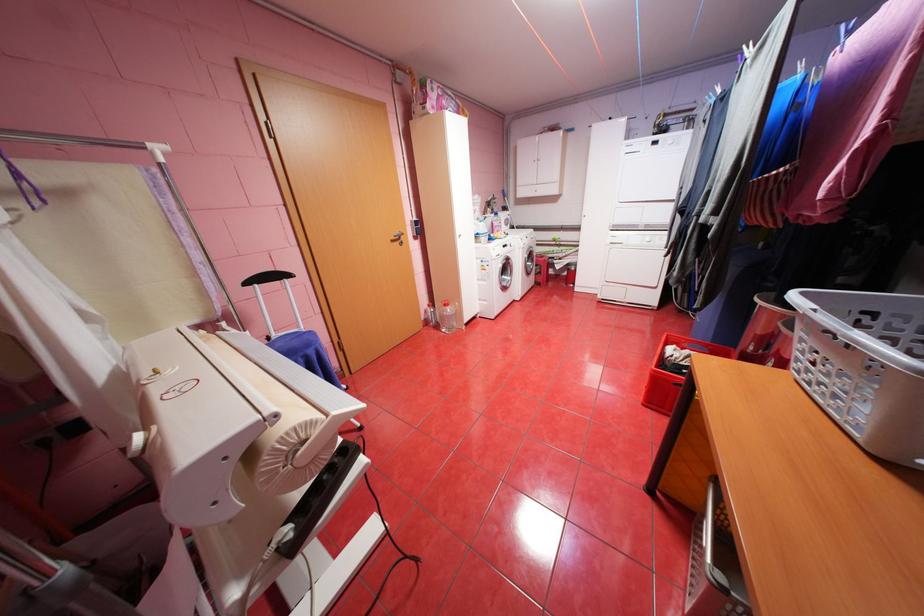
At what (x,y) coordinates should I click in order to perform the action: click on yellow round button. Please return your answer as a coordinate pair (x, y). Looking at the image, I should click on (157, 373).